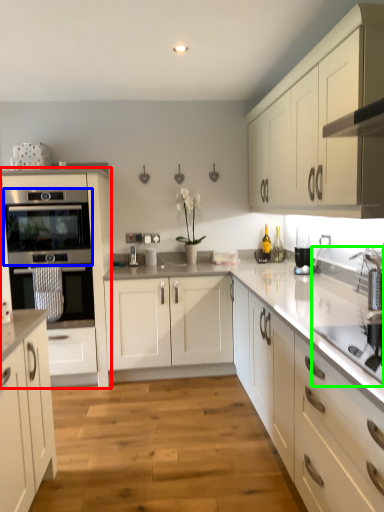
Question: Considering the real-world distances, which object is closest to cabinetry (highlighted by a red box)? oven (highlighted by a blue box) or sink (highlighted by a green box).

Choices:
 (A) oven
 (B) sink

Answer: (A)